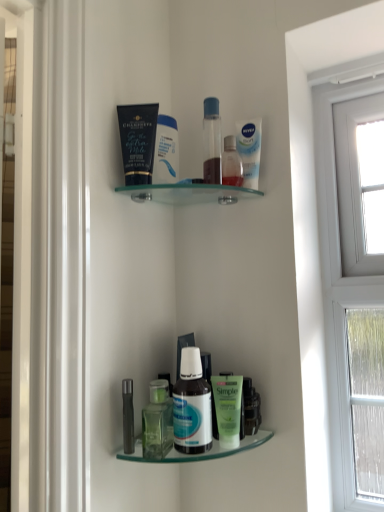
Question: Is matte black tube at upper center taller or shorter than translucent plastic bottle at upper center, the 3th toiletry ordered from the bottom?

Choices:
 (A) tall
 (B) short

Answer: (A)

Question: Based on their sizes in the image, would you say matte black tube at upper center is bigger or smaller than translucent plastic bottle at upper center, the second toiletry viewed from the top?

Choices:
 (A) big
 (B) small

Answer: (A)

Question: Which of these objects is positioned farthest from the transparent plastic bottle at upper center, the second toiletry when ordered from left to right?

Choices:
 (A) green matte bottle at lower center, which is the first bottle from left to right
 (B) green matte lotion at lower center, which is counted as the 2th toiletry, starting from the bottom
 (C) white glossy mouthwash at upper center, which is counted as the 1th mouthwash, starting from the right
 (D) translucent plastic bottle at upper center, which appears as the 1th toiletry when viewed from the right
 (E) metallic silver tube at lower left, the 4th toiletry from the right

Answer: (E)

Question: Estimate the real-world distances between objects in this image. Which object is farther from the matte black tube at upper center?

Choices:
 (A) white glossy mouthwash at upper center, which is counted as the 1th mouthwash, starting from the right
 (B) green matte bottle at lower center, the second bottle from the right
 (C) translucent plastic bottle at upper center, which appears as the 1th toiletry when viewed from the right
 (D) green matte lotion at lower center, which is counted as the 2th toiletry, starting from the bottom
 (E) white glossy bottle at lower center, which ranks as the second bottle in left-to-right order

Answer: (D)